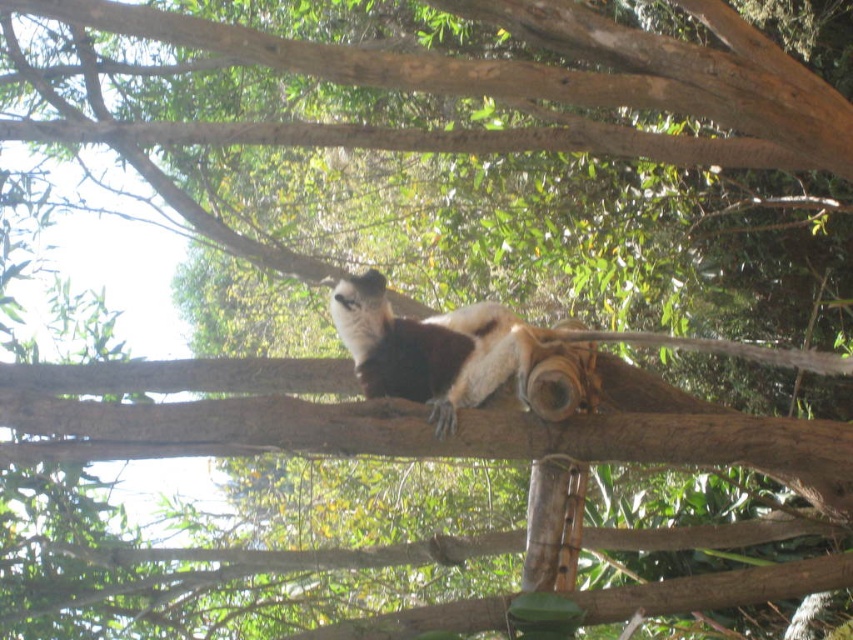
You are a photographer aiming to capture the brown fur monkey at center and the brown rough tree branch at upper center in the same frame. Based on their positions, which object should you adjust your camera to focus on first to ensure both are in the frame?

The brown rough tree branch at upper center is to the left of the brown fur monkey at center, so you should focus on the brown fur monkey at center first as it is closer to the center of the frame, ensuring both objects remain within the camera view.

From the picture: You are a photographer trying to capture the brown fur monkey at center and the brown rough tree branch at upper center in the same frame. Based on their positions, which object is positioned higher in the image?

The brown rough tree branch at upper center is positioned higher than the brown fur monkey at center because it is much taller as brown fur monkey at center.